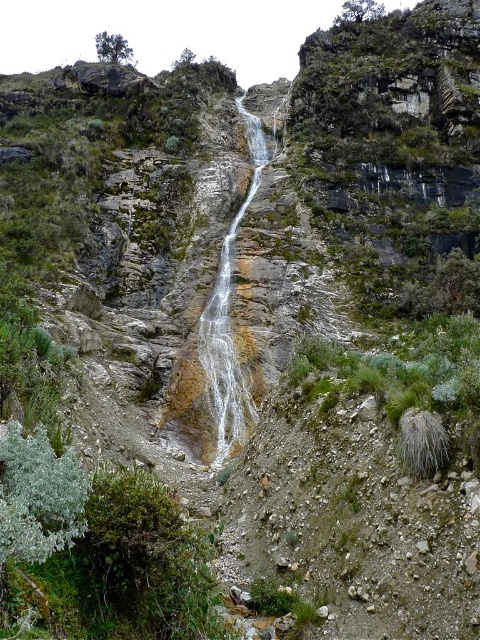
Does point (17, 442) come behind point (107, 33)?

No, (17, 442) is closer to viewer.

Can you confirm if green fuzzy bush at lower left is bigger than green leafy shrub at upper center?

No, green fuzzy bush at lower left is not bigger than green leafy shrub at upper center.

Between point (211, 579) and point (110, 51), which one is positioned behind?

The point (110, 51) is behind.

Locate an element on the screen. green fuzzy bush at lower left is located at coordinates (107, 541).

Can you confirm if clear water at center is positioned to the left of green leafy shrub at upper center?

No, clear water at center is not to the left of green leafy shrub at upper center.

Identify the location of clear water at center. The image size is (480, 640). (228, 323).

Is green fuzzy bush at lower left shorter than clear water at center?

Correct, green fuzzy bush at lower left is not as tall as clear water at center.

Who is positioned more to the left, green fuzzy bush at lower left or clear water at center?

green fuzzy bush at lower left is more to the left.

Where is `green fuzzy bush at lower left`? Image resolution: width=480 pixels, height=640 pixels. green fuzzy bush at lower left is located at coordinates (107, 541).

You are a GUI agent. You are given a task and a screenshot of the screen. Output one action in this format:
    pyautogui.click(x=<x>, y=<y>)
    Task: Click on the green fuzzy bush at lower left
    The width and height of the screenshot is (480, 640).
    Given the screenshot: What is the action you would take?
    pyautogui.click(x=107, y=541)